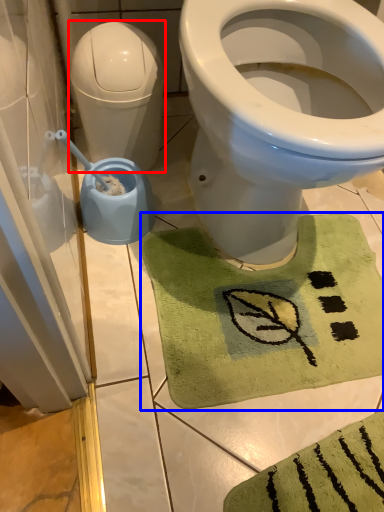
Question: Which point is closer to the camera, water tank (highlighted by a red box) or bath mat (highlighted by a blue box)?

Choices:
 (A) water tank
 (B) bath mat

Answer: (B)